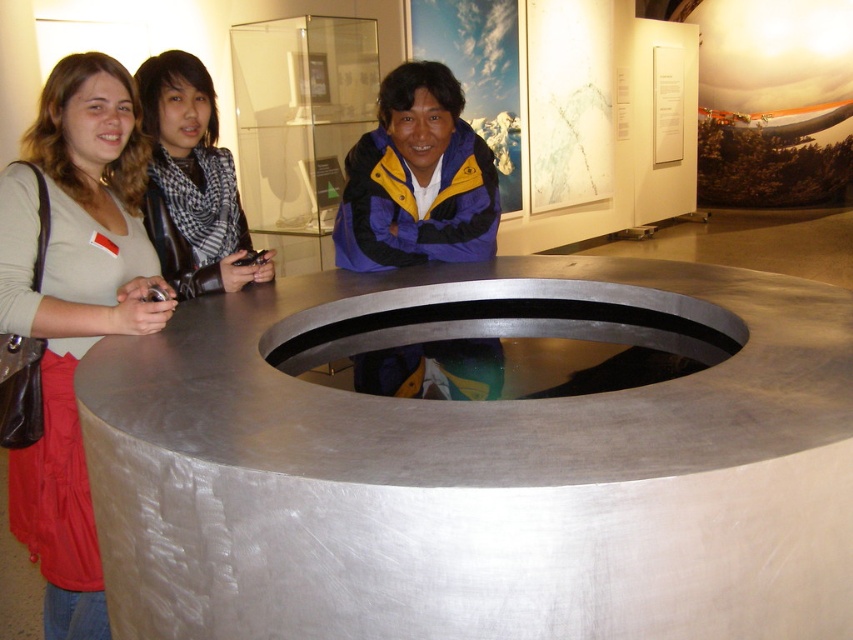
Is matte beige shirt at left taller than matte blue jacket at center?

Indeed, matte beige shirt at left has a greater height compared to matte blue jacket at center.

Can you confirm if matte beige shirt at left is positioned above matte blue jacket at center?

Actually, matte beige shirt at left is below matte blue jacket at center.

The image size is (853, 640). What do you see at coordinates (74, 308) in the screenshot?
I see `matte beige shirt at left` at bounding box center [74, 308].

Where is `matte beige shirt at left`? The image size is (853, 640). matte beige shirt at left is located at coordinates (74, 308).

Can you confirm if matte beige shirt at left is bigger than black leather jacket at center?

Indeed, matte beige shirt at left has a larger size compared to black leather jacket at center.

Can you confirm if matte beige shirt at left is smaller than black leather jacket at center?

Incorrect, matte beige shirt at left is not smaller in size than black leather jacket at center.

Which is behind, point (77, 483) or point (180, 241)?

The point (180, 241) is behind.

The height and width of the screenshot is (640, 853). What are the coordinates of `matte beige shirt at left` in the screenshot? It's located at (74, 308).

Is matte blue jacket at center bigger than black leather jacket at center?

Correct, matte blue jacket at center is larger in size than black leather jacket at center.

Does matte blue jacket at center come behind black leather jacket at center?

That is True.

The height and width of the screenshot is (640, 853). In order to click on matte blue jacket at center in this screenshot , I will do `click(416, 179)`.